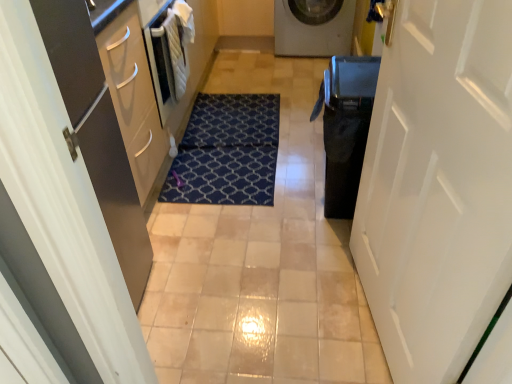
Find the location of a particular element. Image resolution: width=512 pixels, height=384 pixels. vacant space underneath white matte door at right, the first door from the right (from a real-world perspective) is located at coordinates (366, 314).